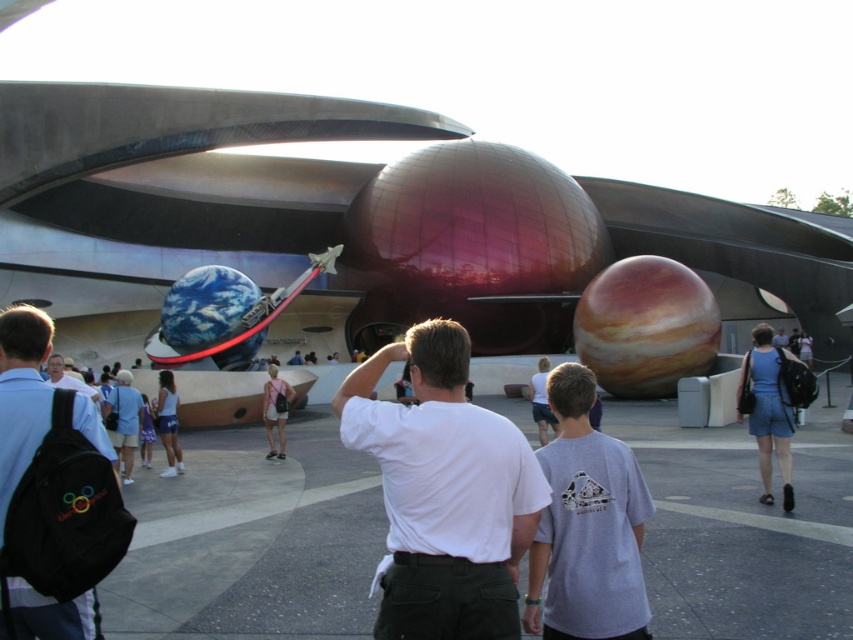
You are standing at the entrance of the space attraction and want to take a photo. You have two points marked on your map as reference points for the best angles. The first point is at coordinate point (467, 464) and the second is at point (27, 352). Which point should you stand at to ensure the spaceship structure is more prominently featured in your photo?

You should stand at point (467, 464) because it is closer to the camera, allowing the spaceship structure to appear larger and more prominent in the photo compared to point (27, 352).

You are standing at the entrance of the space attraction and see a black fabric backpack at left and a light blue shirt at center. If you want to reach both objects, which one should you approach first to minimize the total distance traveled?

To minimize the total distance traveled, you should approach the light blue shirt at center first since it is closer to the entrance than the black fabric backpack at left. After reaching the light blue shirt at center, you can then proceed to the black fabric backpack at left, resulting in a shorter overall path compared to going to the backpack first.